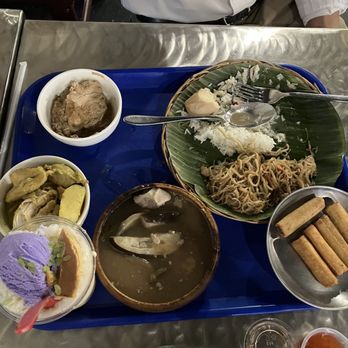
The width and height of the screenshot is (348, 348). What are the coordinates of `fork` in the screenshot? It's located at click(271, 96).